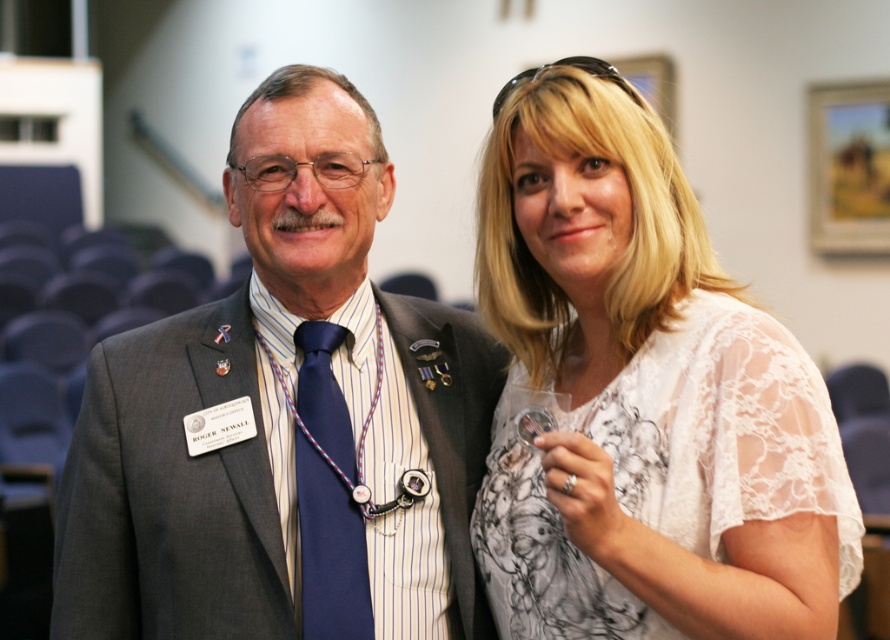
From the picture: You are a photographer at the event and need to position a spotlight on the white lace blouse at upper right. The spotlight can only be placed at coordinates point (x=641, y=396). Is this the correct position to illuminate the white lace blouse at upper right?

Yes, the point (x=641, y=396) marks the location of the white lace blouse at upper right, so placing the spotlight there will correctly illuminate it.

Based on the photo, based on the scene description, can you determine the spatial relationship between the gray suit at center and the navy blue silk tie at center? Specifically, which one is positioned to the left?

The gray suit at center is to the left of the navy blue silk tie at center.

In the scene shown: You are a photographer at a formal event. You need to take a photo of the two people standing in front of you. The camera you are using has a focus range of 12 inches. Can you capture both the white lace blouse at upper right and the navy blue silk tie at center in focus without adjusting your position?

The distance between the white lace blouse at upper right and the navy blue silk tie at center is 14.00 inches, which exceeds the camera focus range of 12 inches. Therefore, you cannot capture both in focus without adjusting your position.